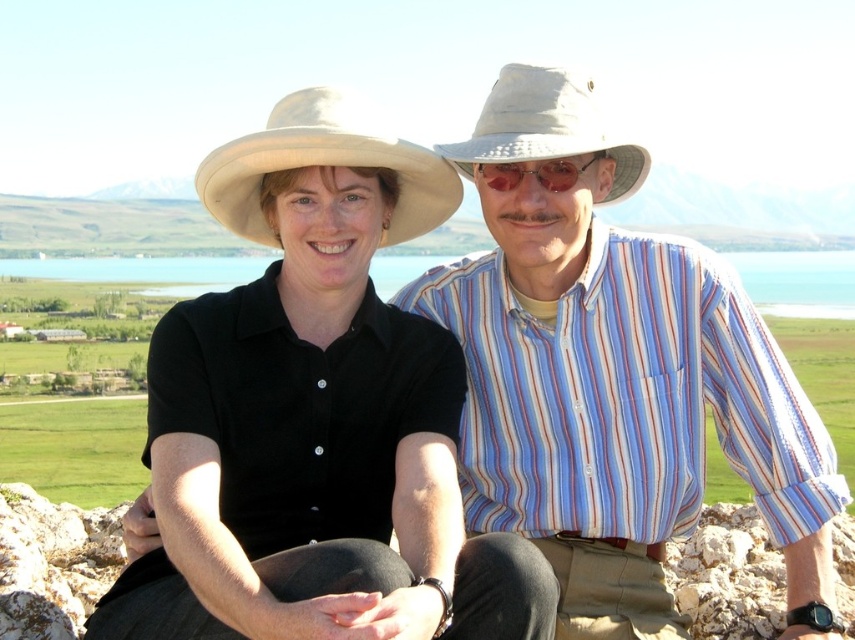
You are a photographer trying to capture the scene. You notice the beige fabric cowboy hat at upper center and the shiny metallic sunglasses at center. Which object is covering part of the other?

The beige fabric cowboy hat at upper center is positioned over the shiny metallic sunglasses at center, so it is covering part of the sunglasses.

You are a photographer taking a picture of two people sitting outside. You notice the matte black hat at center and the beige fabric cowboy hat at upper left. Which hat is positioned lower in the image?

The matte black hat at center is positioned below the beige fabric cowboy hat at upper left, so the matte black hat at center is lower in the image.